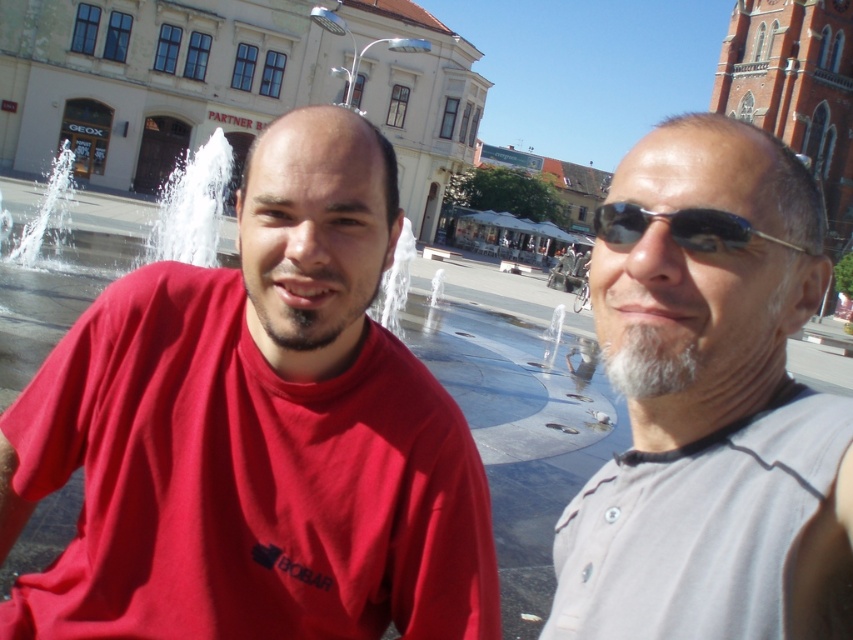
Is point (756, 200) less distant than point (263, 314)?

Yes, point (756, 200) is in front of point (263, 314).

Based on the photo, is gray fabric shirt at center positioned behind dark brown stubble at left?

No, it is not.

Does point (809, 586) come farther from viewer compared to point (323, 289)?

No, it is not.

Image resolution: width=853 pixels, height=640 pixels. What are the coordinates of `gray fabric shirt at center` in the screenshot? It's located at (711, 404).

Between dark brown stubble at left and black plastic sunglasses at right, which one appears on the left side from the viewer's perspective?

dark brown stubble at left is more to the left.

Is dark brown stubble at left smaller than black plastic sunglasses at right?

No, dark brown stubble at left is not smaller than black plastic sunglasses at right.

Locate an element on the screen. dark brown stubble at left is located at coordinates (309, 298).

Is matte red t-shirt at center positioned behind white fluffy beard at right?

No, matte red t-shirt at center is in front of white fluffy beard at right.

Between point (238, 584) and point (680, 390), which one is positioned in front?

Positioned in front is point (680, 390).

Find the location of `matte red t-shirt at center`. matte red t-shirt at center is located at coordinates (256, 433).